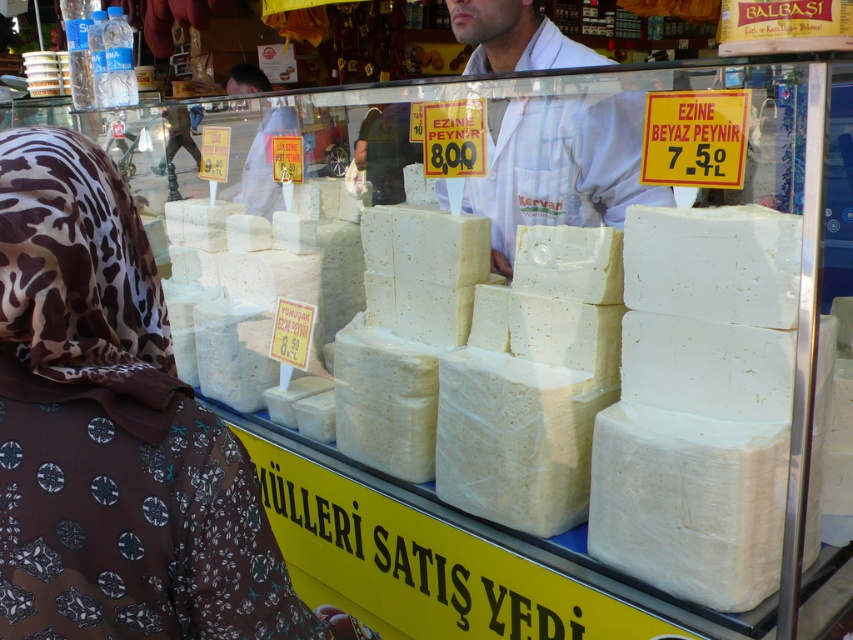
From the picture: You are a customer at the cheese stall and want to buy the white crumbly cheese at center. The vendor mentions that the white lab coat at center is part of their promotional display. Which item is bigger in size?

The white crumbly cheese at center is larger in size compared to the white lab coat at center.

You are a customer at the cheese stall and need to choose between the brown printed fabric at lower left and the white lab coat at center. Which item is smaller in size?

The brown printed fabric at lower left is smaller in size compared to the white lab coat at center.